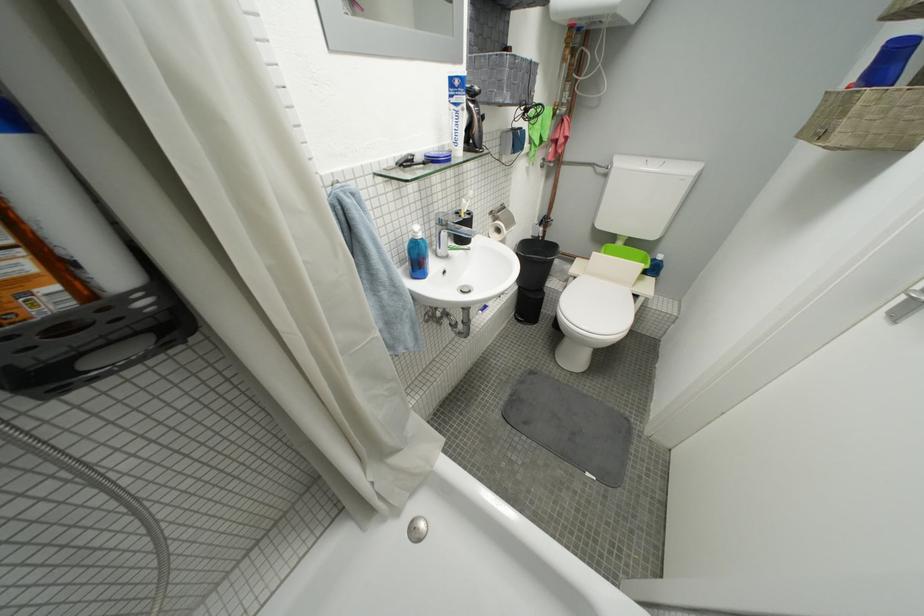
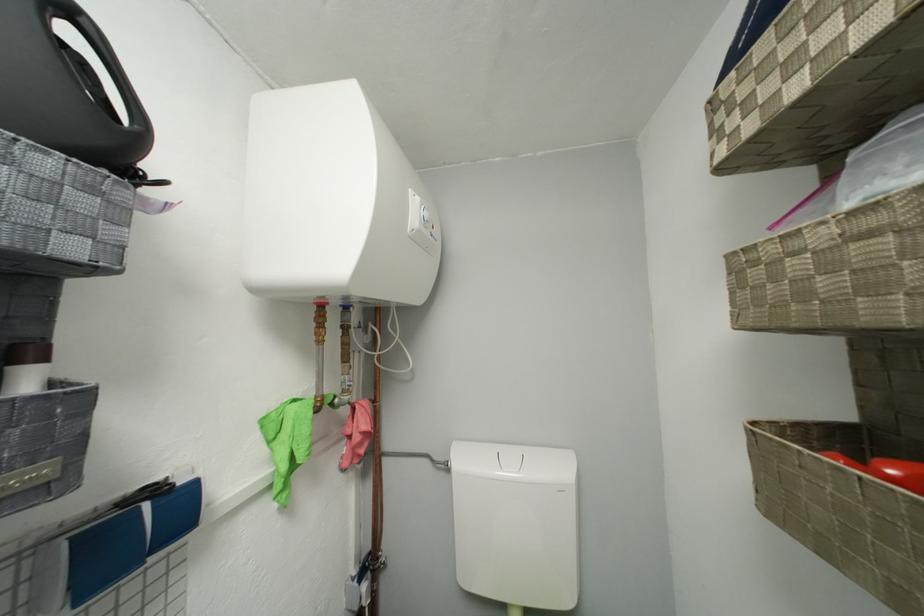
The first image is from the beginning of the video and the second image is from the end. How did the camera likely rotate when shooting the video?

The camera rotated toward right-up.